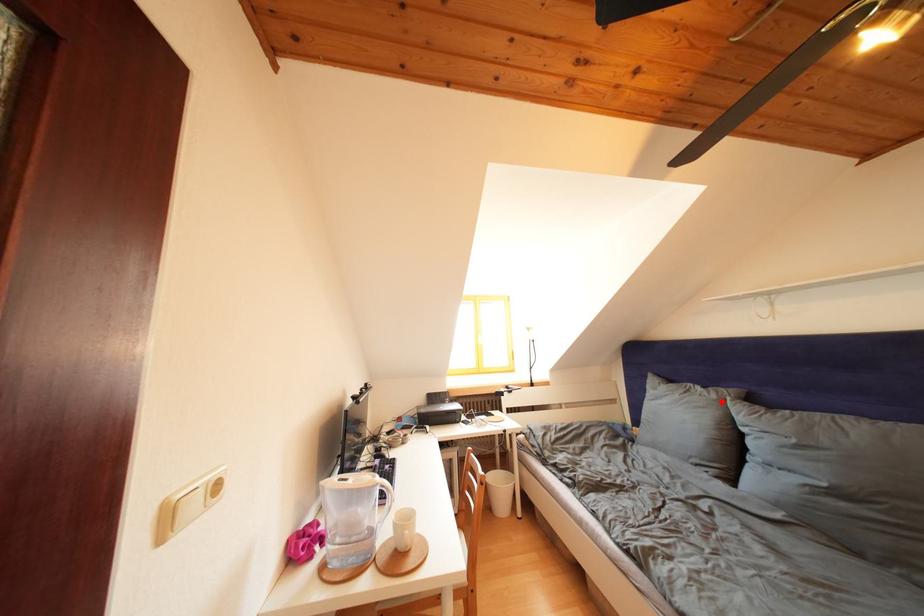
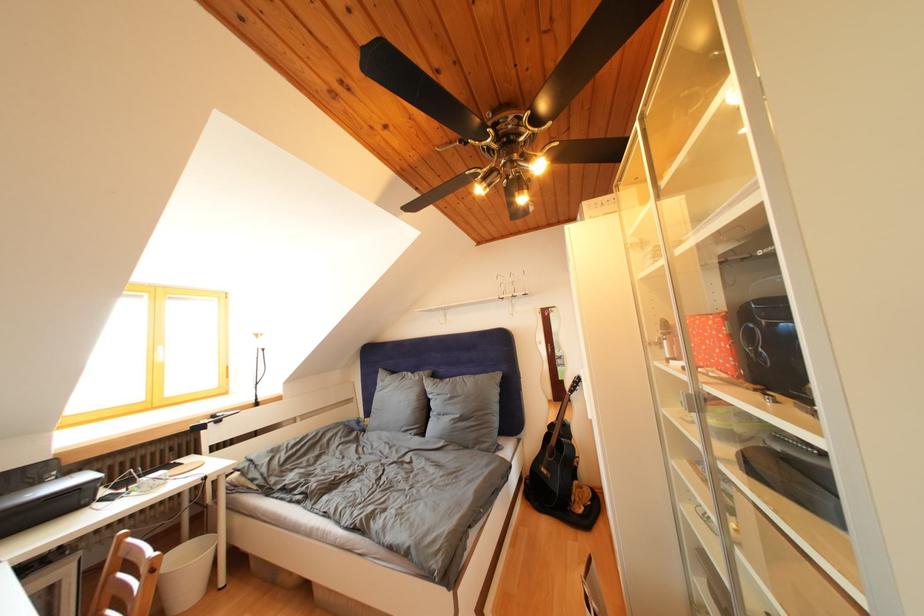
Where in the second image is the point corresponding to the highlighted location from the first image?

(426, 383)